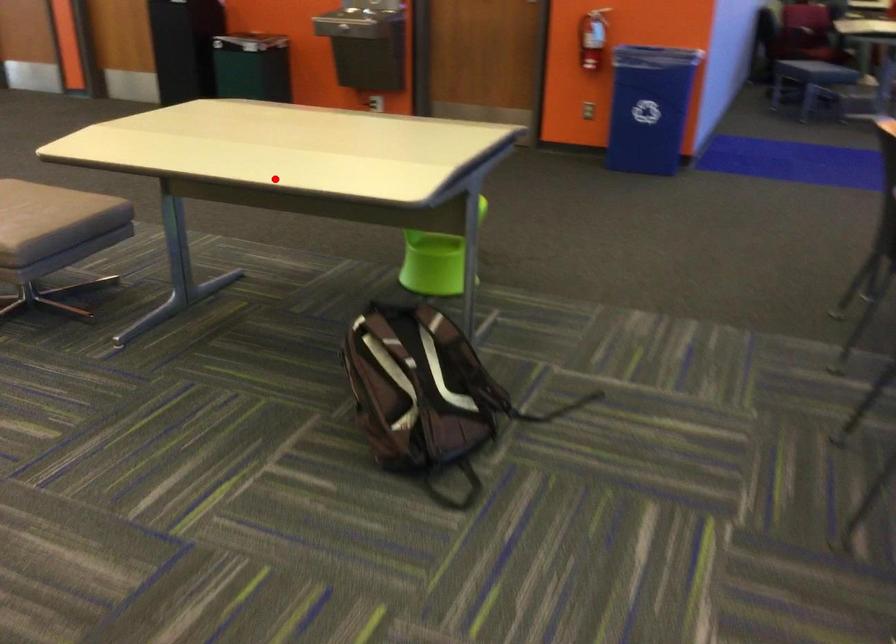
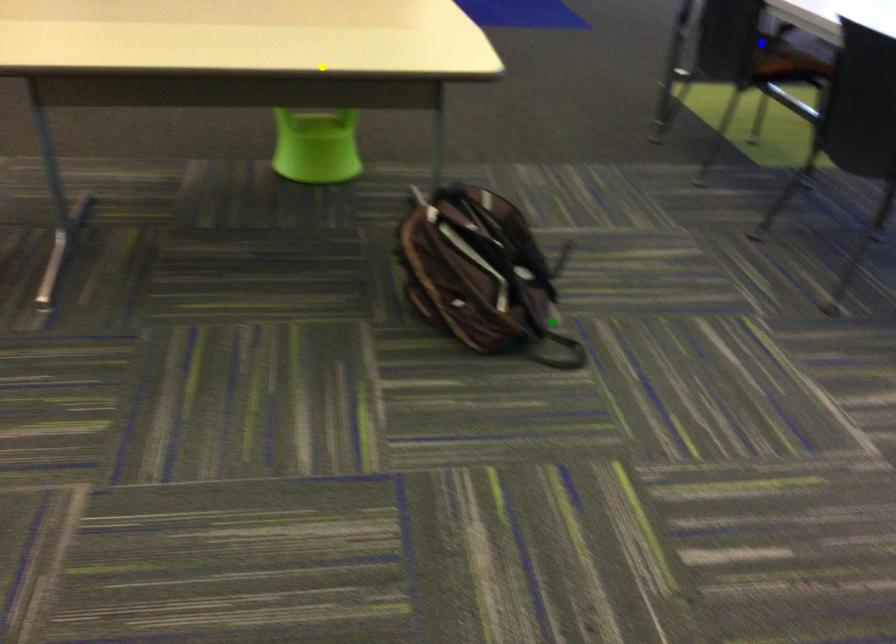
Question: I am providing you with two images of the same scene from different viewpoints. A red point is marked on the first image. You are given multiple points on the second image. Which mark in image 2 goes with the point in image 1?

Choices:
 (A) green point
 (B) yellow point
 (C) blue point

Answer: (B)